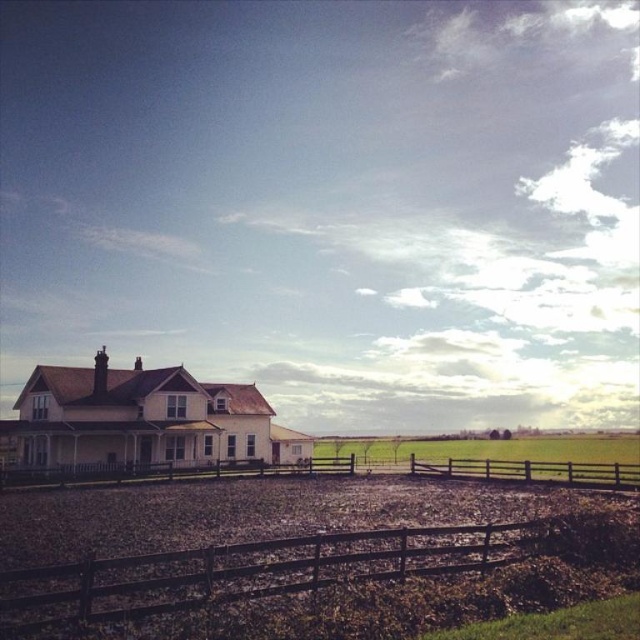
You are a gardener planning to mow the green grass at center. The brown wooden fence at center is in the way. Can you mow the grass without moving the fence?

The brown wooden fence at center has a lesser width compared to green grass at center, so the fence is narrow enough to allow mowing around it without needing to move it.

You are standing at the point with coordinates (630, 481) and want to walk towards the house on the left. Is the point at (504, 472) in front of you or behind you as you move toward the house?

The point at (504, 472) is behind point (630, 481), so when you move towards the house on the left, the point at (504, 472) will be behind you.